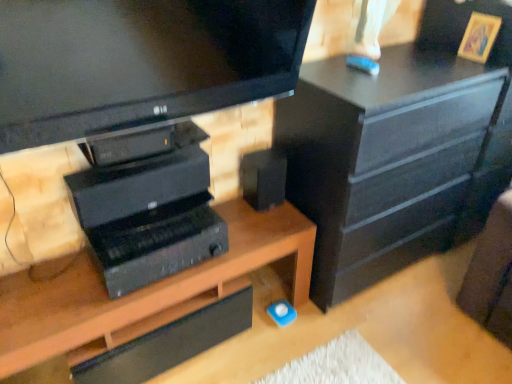
This screenshot has width=512, height=384. What are the coordinates of `vacant space that is in between black matte chest of drawers at upper right and wooden desk at center` in the screenshot? It's located at pyautogui.click(x=262, y=347).